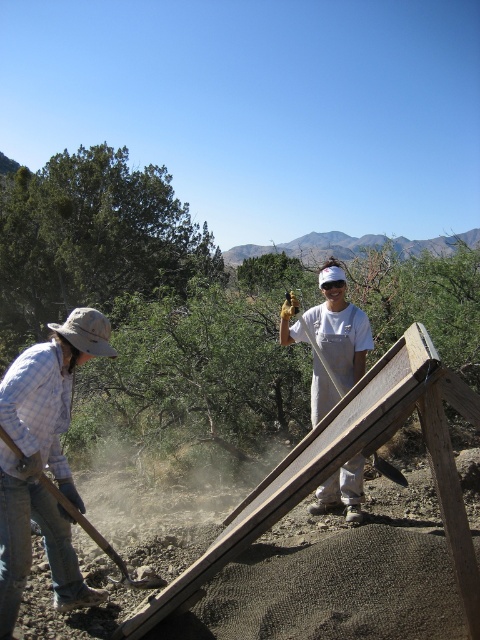
Can you confirm if plaid cotton shirt at lower left is positioned to the right of wooden shovel at center?

In fact, plaid cotton shirt at lower left is to the left of wooden shovel at center.

Describe the element at coordinates (43, 461) in the screenshot. The height and width of the screenshot is (640, 480). I see `plaid cotton shirt at lower left` at that location.

This screenshot has width=480, height=640. Identify the location of plaid cotton shirt at lower left. (43, 461).

This screenshot has width=480, height=640. What do you see at coordinates (100, 540) in the screenshot?
I see `wooden handle shovel at lower left` at bounding box center [100, 540].

How distant is wooden handle shovel at lower left from wooden shovel at center?

A distance of 6.88 feet exists between wooden handle shovel at lower left and wooden shovel at center.

Identify the location of wooden handle shovel at lower left. (100, 540).

Is plaid cotton shirt at lower left to the right of wooden handle shovel at lower left from the viewer's perspective?

No, plaid cotton shirt at lower left is not to the right of wooden handle shovel at lower left.

Is point (29, 429) positioned behind point (119, 564)?

No, (29, 429) is in front of (119, 564).

At what (x,y) coordinates should I click in order to perform the action: click on plaid cotton shirt at lower left. Please return your answer as a coordinate pair (x, y). Looking at the image, I should click on (43, 461).